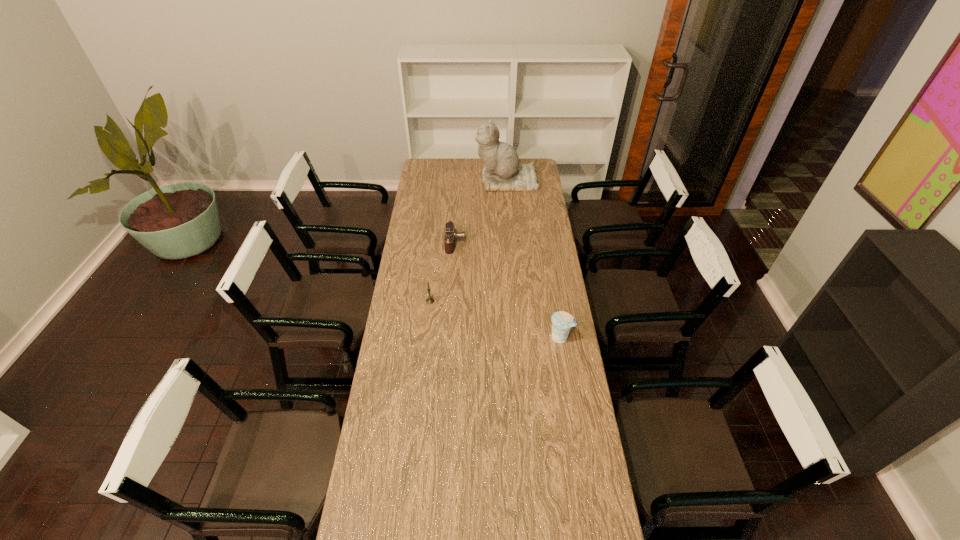
Locate an element on the screen. the farthest object is located at coordinates [502, 171].

This screenshot has height=540, width=960. What are the coordinates of `cat` in the screenshot? It's located at (502, 171).

Where is `candle`? This screenshot has height=540, width=960. candle is located at coordinates (429, 300).

Locate an element on the screen. the second nearest object is located at coordinates (429, 300).

The height and width of the screenshot is (540, 960). I want to click on yogurt, so click(x=562, y=322).

Where is `the third object from right to left`? This screenshot has height=540, width=960. the third object from right to left is located at coordinates (451, 235).

The image size is (960, 540). I want to click on the shortest object, so pos(451,235).

In order to click on vacant space located 0.170m on the front-facing side of the cat in this screenshot , I will do `click(446, 180)`.

You are a GUI agent. You are given a task and a screenshot of the screen. Output one action in this format:
    pyautogui.click(x=<x>, y=<y>)
    Task: Click on the free space located 0.050m on the front-facing side of the cat
    
    Given the screenshot: What is the action you would take?
    pyautogui.click(x=467, y=180)

Identify the location of vacant point located 0.250m on the front-facing side of the cat. This screenshot has height=540, width=960. (433, 180).